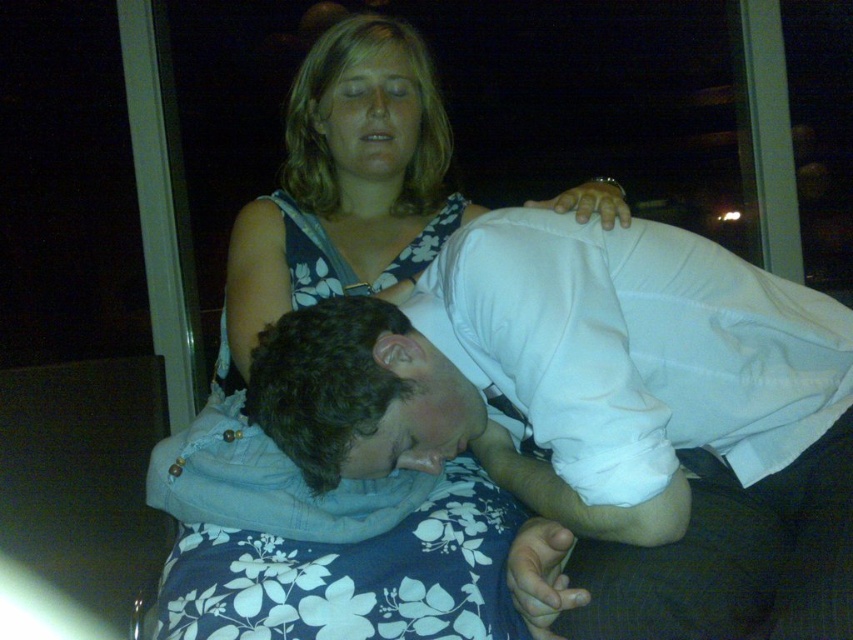
Question: Which point is closer to the camera?

Choices:
 (A) coord(424,333)
 (B) coord(323,150)

Answer: (A)

Question: Does white cotton shirt at center come behind blue floral dress at center?

Choices:
 (A) yes
 (B) no

Answer: (B)

Question: Does white cotton shirt at center appear over blue floral dress at center?

Choices:
 (A) no
 (B) yes

Answer: (A)

Question: Can you confirm if white cotton shirt at center is positioned to the left of blue floral dress at center?

Choices:
 (A) no
 (B) yes

Answer: (A)